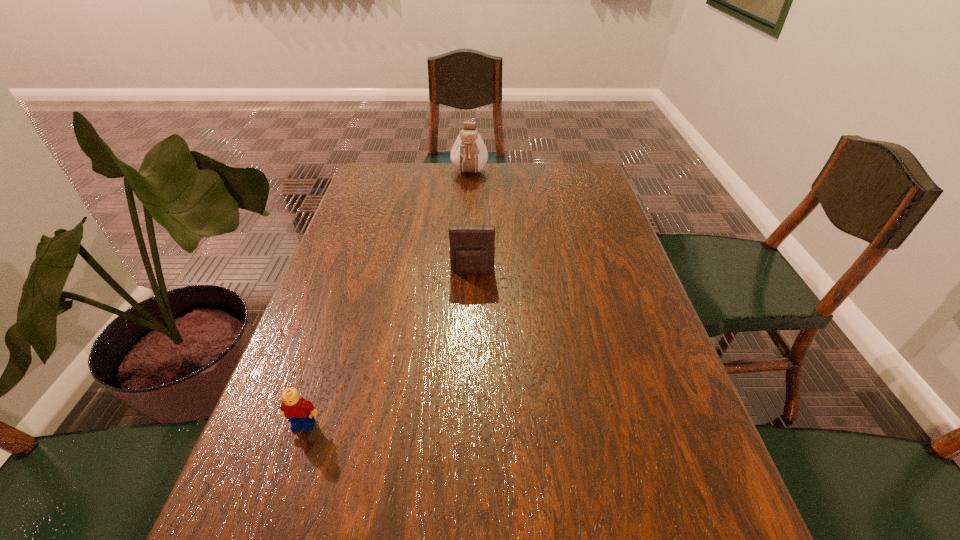
Find the location of a particular element. The width and height of the screenshot is (960, 540). vacant area between the Lego and the farther pouch is located at coordinates (387, 299).

Identify the location of free space between the taller pouch and the leftmost object. (387, 299).

The height and width of the screenshot is (540, 960). Find the location of `vacant region between the shorter pouch and the tallest object`. vacant region between the shorter pouch and the tallest object is located at coordinates (471, 223).

Where is `blank region between the farther pouch and the leftmost object`? blank region between the farther pouch and the leftmost object is located at coordinates (387, 299).

Identify the location of object that is the second closest to the farther pouch. The width and height of the screenshot is (960, 540). (300, 413).

Find the location of a particular element. This screenshot has height=540, width=960. object that is the nearest to the second tallest object is located at coordinates (469, 154).